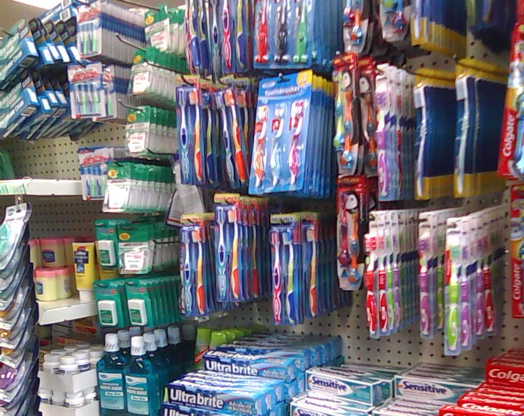
This screenshot has width=524, height=416. I want to click on wall, so click(x=428, y=349).